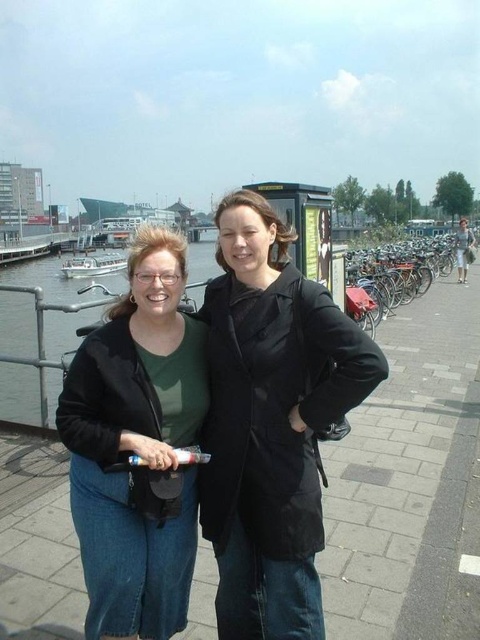
You are a delivery robot navigating a narrow sidewalk. You see the paved stone sidewalk at center and the green matte shirt at center. Which object is higher from the ground?

The paved stone sidewalk at center is above the green matte shirt at center, so the paved stone sidewalk at center is higher from the ground.